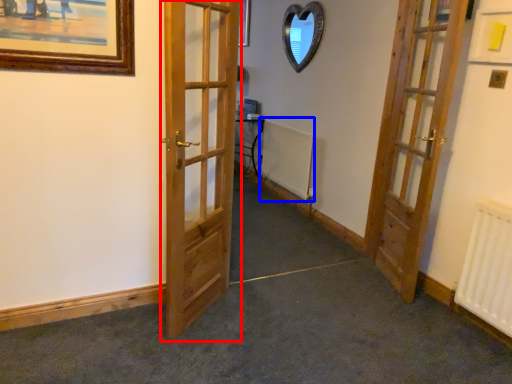
Question: Among these objects, which one is nearest to the camera, door (highlighted by a red box) or radiator (highlighted by a blue box)?

Choices:
 (A) door
 (B) radiator

Answer: (A)